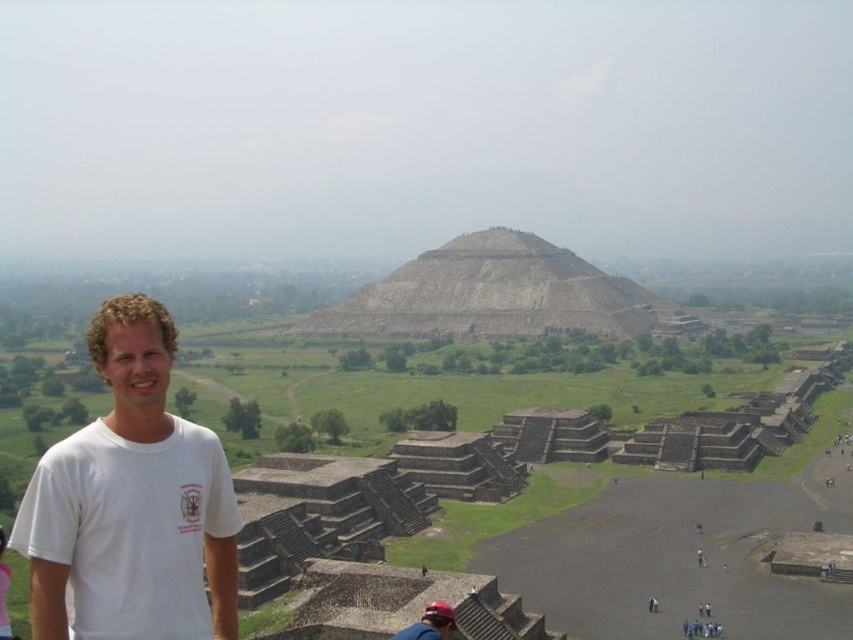
Question: Which of the following is the farthest from the observer?

Choices:
 (A) stone textured pyramid at center
 (B) white cotton t-shirt at left

Answer: (A)

Question: Observing the image, what is the correct spatial positioning of white cotton t-shirt at left in reference to stone textured pyramid at center?

Choices:
 (A) below
 (B) above

Answer: (A)

Question: Which point is farther to the camera?

Choices:
 (A) white cotton t-shirt at left
 (B) stone textured pyramid at center

Answer: (B)

Question: Is white cotton t-shirt at left further to camera compared to stone textured pyramid at center?

Choices:
 (A) yes
 (B) no

Answer: (B)

Question: Does white cotton t-shirt at left come behind stone textured pyramid at center?

Choices:
 (A) no
 (B) yes

Answer: (A)